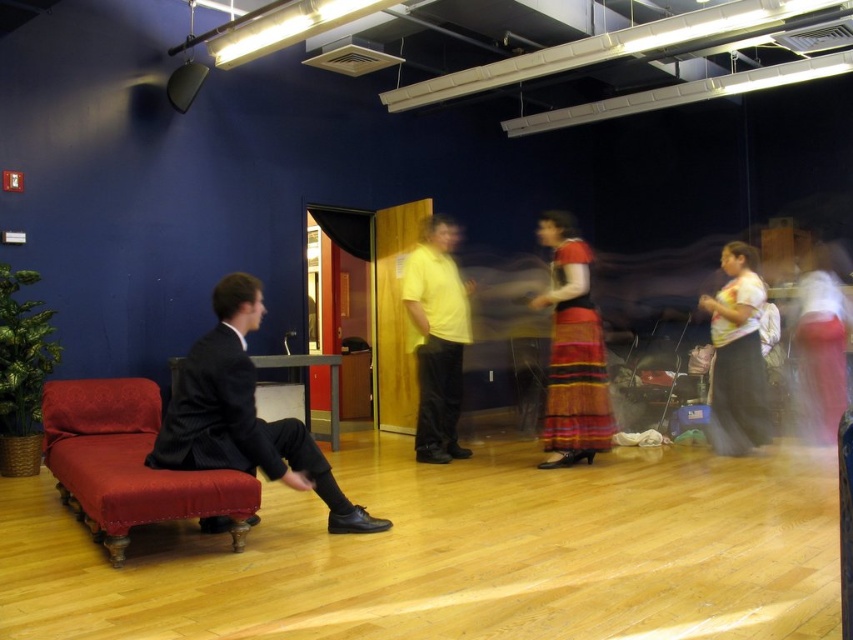
Can you confirm if yellow matte shirt at center is positioned above white t-shirt at right?

Indeed, yellow matte shirt at center is positioned over white t-shirt at right.

Which is in front, point (440, 436) or point (751, 420)?

Positioned in front is point (751, 420).

Is point (434, 262) positioned behind point (724, 396)?

Yes.

Image resolution: width=853 pixels, height=640 pixels. Find the location of `yellow matte shirt at center`. yellow matte shirt at center is located at coordinates (437, 337).

Where is `velvet red couch at left`? Image resolution: width=853 pixels, height=640 pixels. velvet red couch at left is located at coordinates (126, 461).

Is velvet red couch at left wider than white t-shirt at right?

Yes, velvet red couch at left is wider than white t-shirt at right.

Which is in front, point (102, 458) or point (749, 362)?

Point (102, 458) is in front.

This screenshot has width=853, height=640. What are the coordinates of `velvet red couch at left` in the screenshot? It's located at (126, 461).

Can you confirm if black suit at left is positioned above white t-shirt at right?

Actually, black suit at left is below white t-shirt at right.

Can you confirm if black suit at left is taller than white t-shirt at right?

No, black suit at left is not taller than white t-shirt at right.

This screenshot has height=640, width=853. What are the coordinates of `black suit at left` in the screenshot? It's located at (242, 413).

Locate an element on the screen. black suit at left is located at coordinates (242, 413).